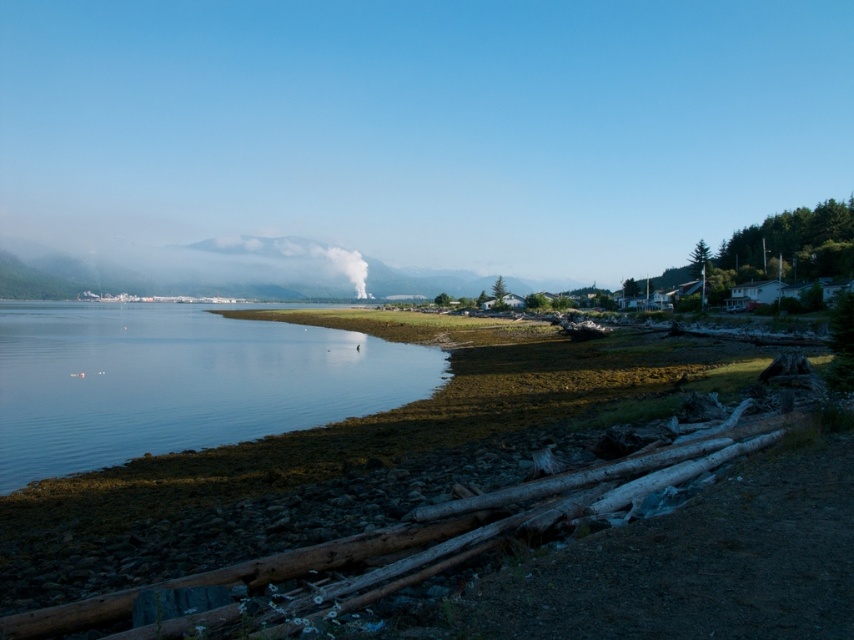
Question: Is the position of clear water at lower left more distant than that of rusty wood logs at lower left?

Choices:
 (A) no
 (B) yes

Answer: (B)

Question: Can you confirm if clear water at lower left is positioned to the right of white smoke at center?

Choices:
 (A) no
 (B) yes

Answer: (A)

Question: Among these objects, which one is nearest to the camera?

Choices:
 (A) white smoke at center
 (B) clear water at lower left
 (C) rusty wood logs at lower left

Answer: (C)

Question: Which is nearer to the white smoke at center?

Choices:
 (A) rusty wood logs at lower left
 (B) clear water at lower left

Answer: (B)

Question: Can you confirm if clear water at lower left is positioned to the right of rusty wood logs at lower left?

Choices:
 (A) yes
 (B) no

Answer: (B)

Question: Which point is farther from the camera taking this photo?

Choices:
 (A) (379, 364)
 (B) (477, 522)

Answer: (A)